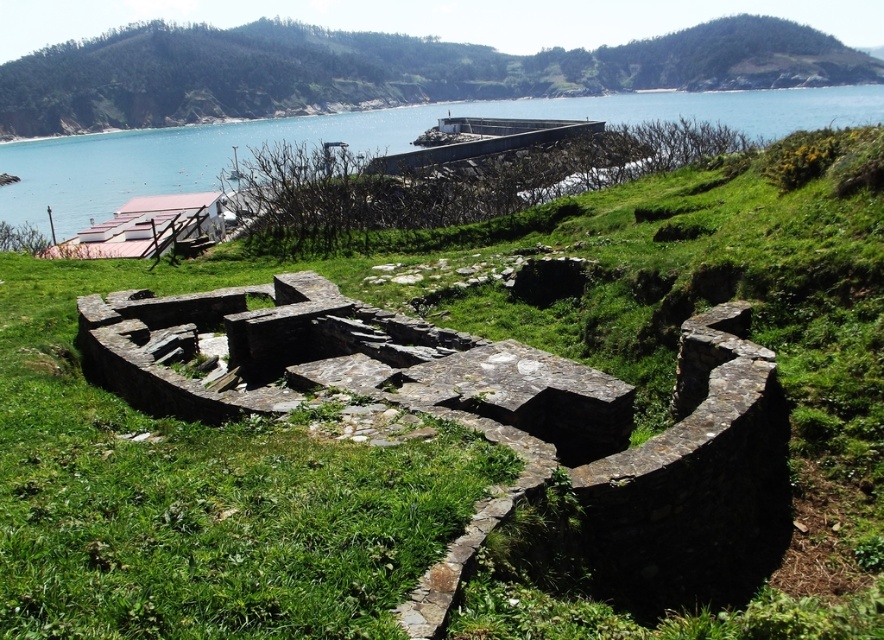
Question: Which of the following is the farthest from the observer?

Choices:
 (A) (164, 88)
 (B) (671, 92)

Answer: (B)

Question: Which point is farther to the camera?

Choices:
 (A) blue water at center
 (B) green stone ruins at center

Answer: (B)

Question: Does green stone ruins at center appear on the right side of blue water at center?

Choices:
 (A) yes
 (B) no

Answer: (B)

Question: Can you confirm if green stone ruins at center is positioned to the left of blue water at center?

Choices:
 (A) no
 (B) yes

Answer: (B)

Question: Is green stone ruins at center thinner than blue water at center?

Choices:
 (A) yes
 (B) no

Answer: (B)